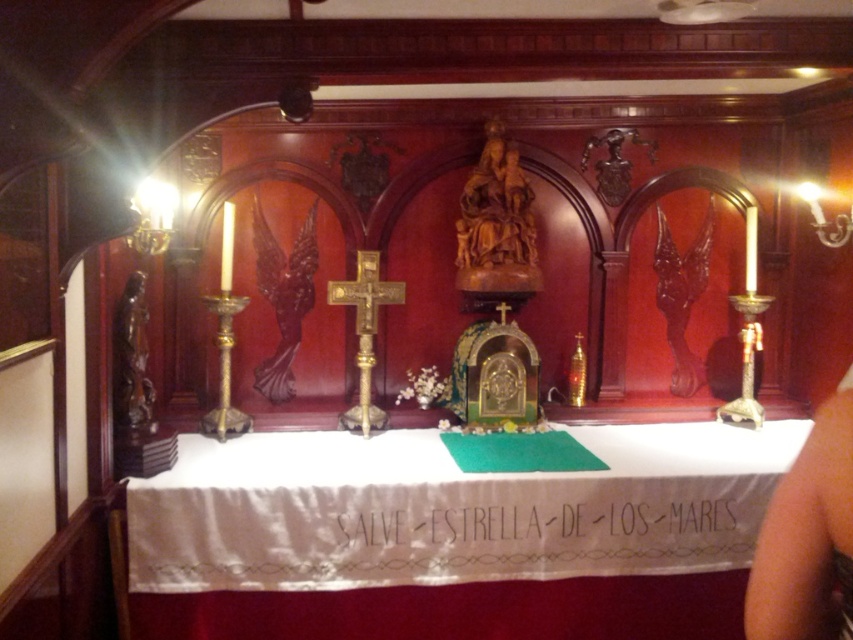
You are standing in front of the altar and want to place a small bouquet of flowers on the closest object. Which object should you choose between the white satin tablecloth at center and the black fabric at center?

The white satin tablecloth at center is closer to the viewer than the black fabric at center, so you should place the bouquet on the white satin tablecloth at center.

You are standing in front of the altar and want to place a bouquet of flowers on the white satin tablecloth at center. If you are currently 8 feet away from the tablecloth, can you reach it without moving closer?

The white satin tablecloth at center and viewer are 7.89 feet apart from each other. Since you are currently 8 feet away, you are slightly too far to reach it without moving closer.